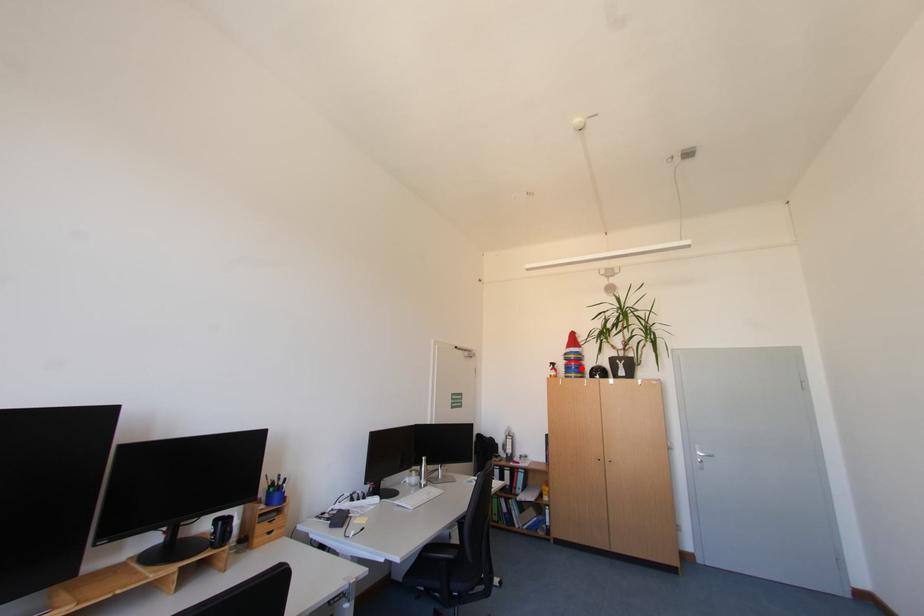
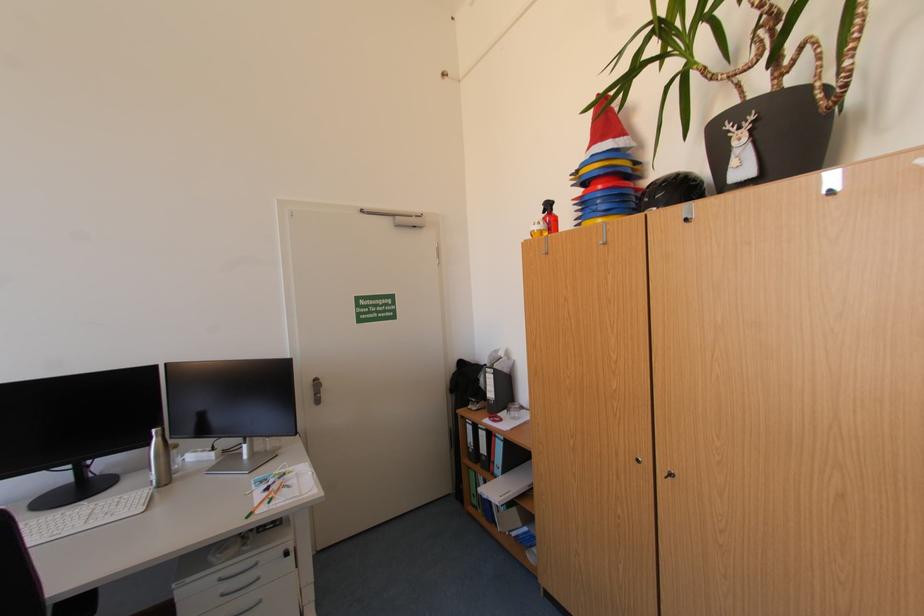
Find the pixel in the second image that matches the highlighted location in the first image.

(606, 203)